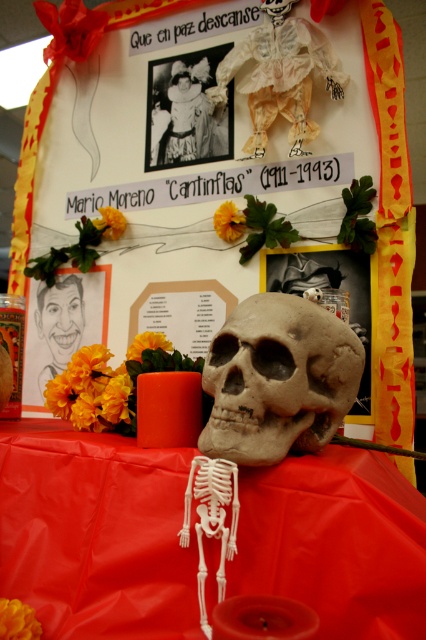
Where is the white paper doll at upper center located in the image?

The white paper doll at upper center is located at point (279, 76) in the image.

You are an anthropologist studying the altar setup. You notice a point marked at coordinates (x=183, y=115). What is located at this point?

The point at (x=183, y=115) marks the location of the matte black dress at center.

Based on the photo, you are an artist who wants to paint the altar scene. You notice the white paper doll at upper center and the matte black caricature at center. Which object should you paint first to maintain proper perspective?

You should paint the white paper doll at upper center first because it is closer to the viewer than the matte black caricature at center, so it should be layered over the latter in your painting.